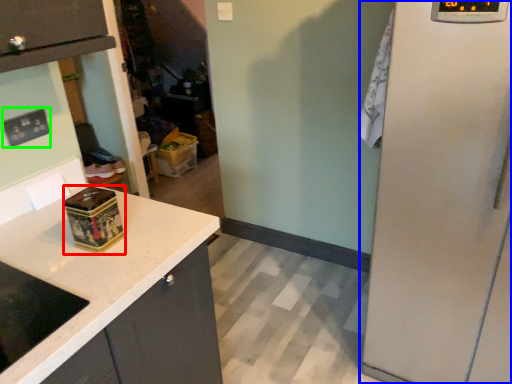
Question: Which is farther away from appliance (highlighted by a red box)? appliance (highlighted by a blue box) or electric outlet (highlighted by a green box)?

Choices:
 (A) appliance
 (B) electric outlet

Answer: (A)